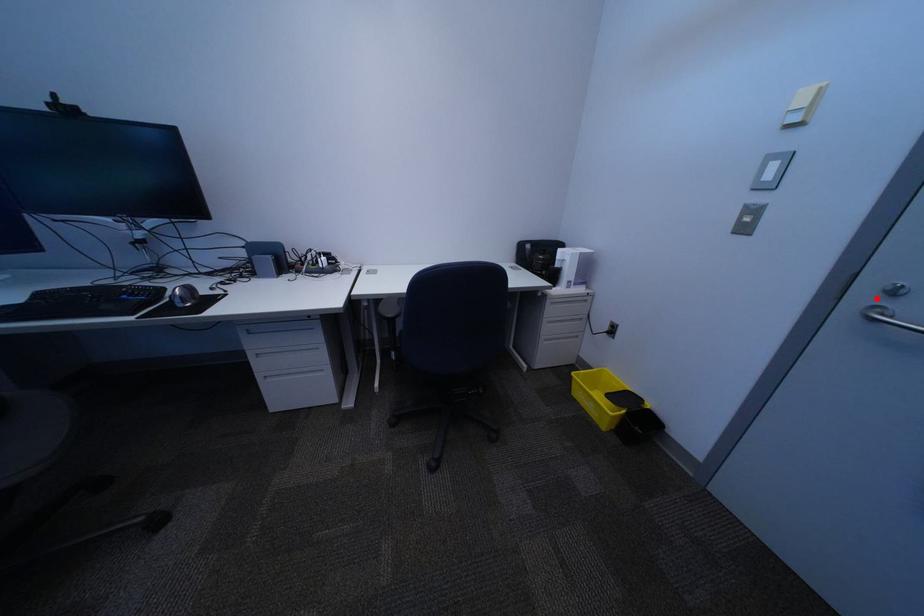
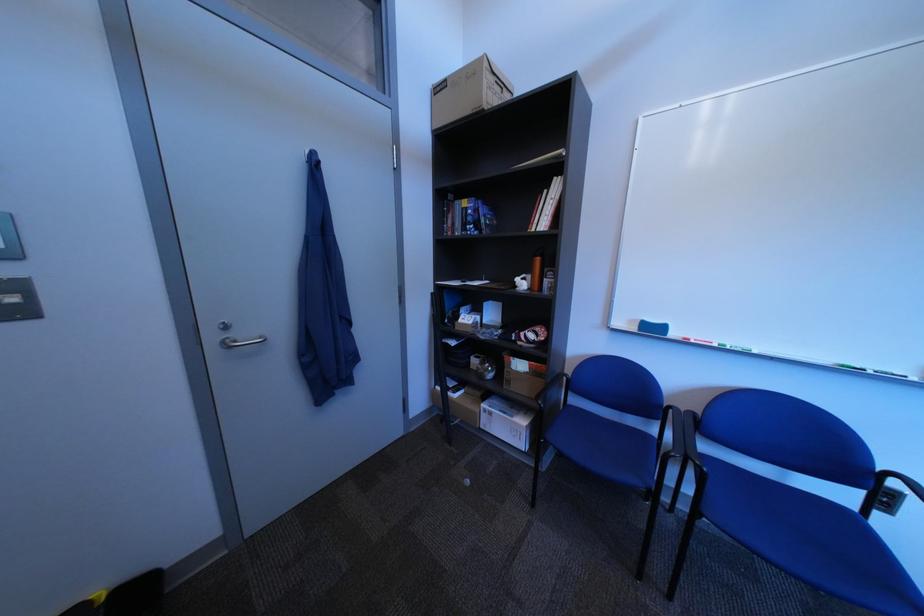
Where in the second image is the point corresponding to the highlighted location from the first image?

(226, 339)